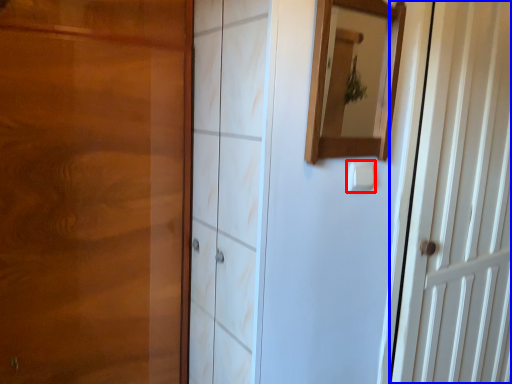
Question: Which object appears closest to the camera in this image, light switch (highlighted by a red box) or door (highlighted by a blue box)?

Choices:
 (A) light switch
 (B) door

Answer: (A)